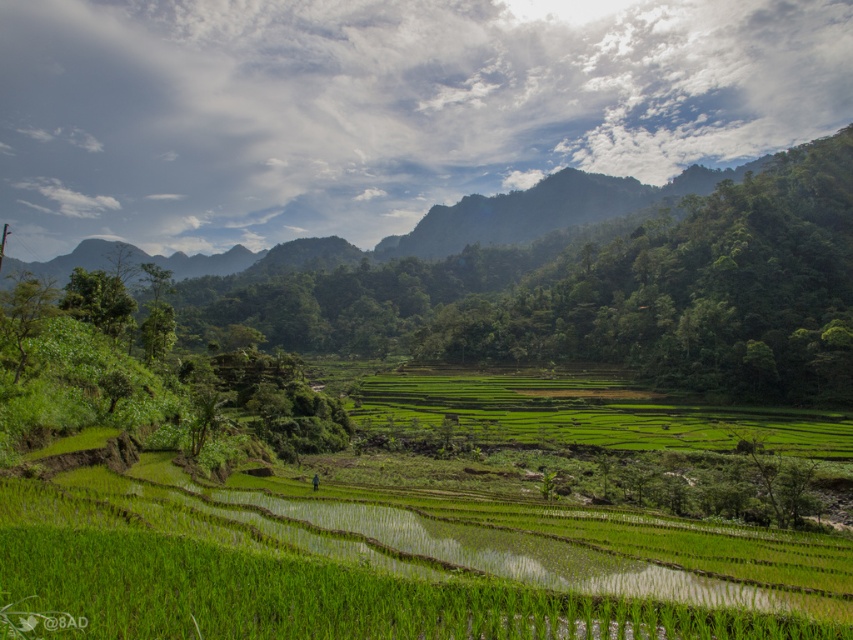
Can you confirm if green grassy rice field at center is wider than green grassy field at center?

No, green grassy rice field at center is not wider than green grassy field at center.

Consider the image. Which is above, green grassy rice field at center or green grassy field at center?

green grassy rice field at center is above.

The image size is (853, 640). What do you see at coordinates (345, 572) in the screenshot? I see `green grassy rice field at center` at bounding box center [345, 572].

The image size is (853, 640). Identify the location of green grassy rice field at center. tap(345, 572).